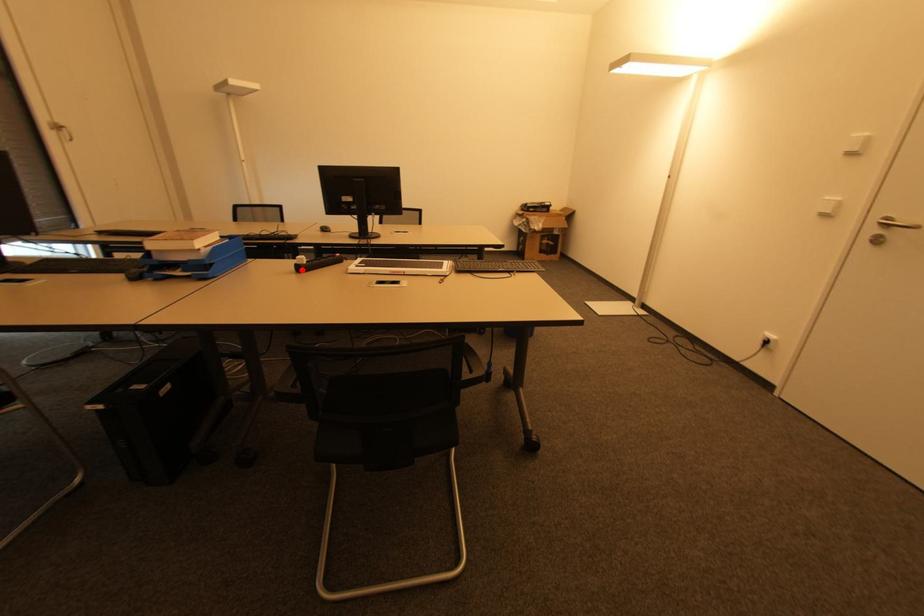
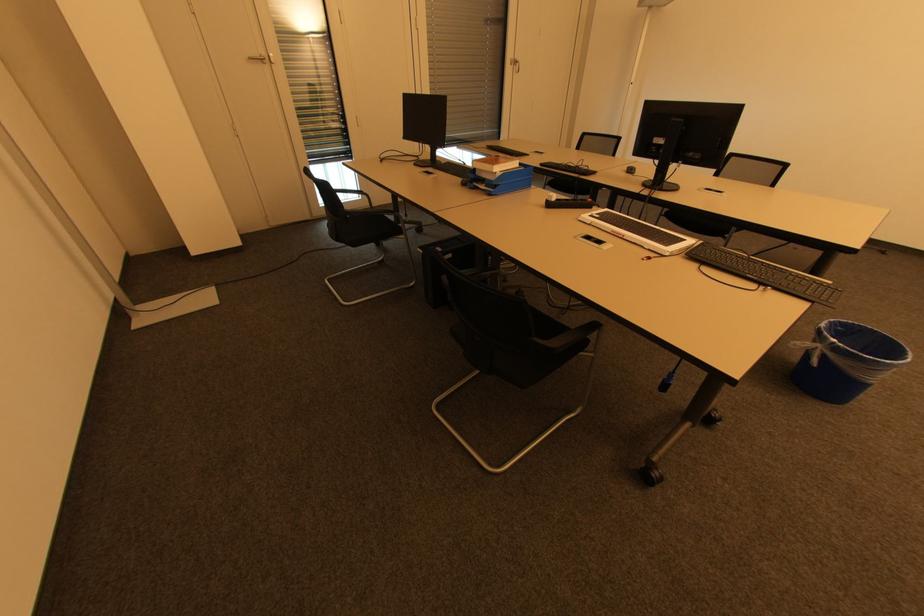
Question: I am providing you with two images of the same scene from different viewpoints. A red point is marked on the first image. At the location where the point appears in image 1, is it still visible in image 2?

Choices:
 (A) Yes
 (B) No

Answer: (A)